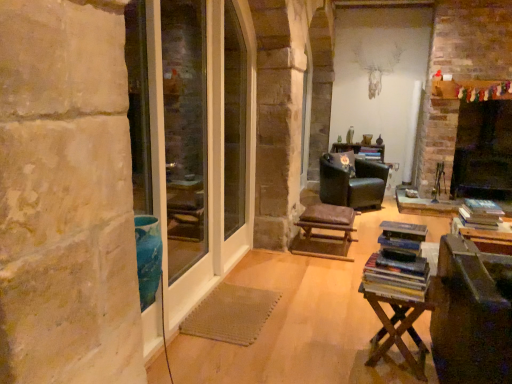
Image resolution: width=512 pixels, height=384 pixels. I want to click on vacant area located to the right-hand side of clear glass screen door at left, which is the 2th screen door in left-to-right order, so coord(281,298).